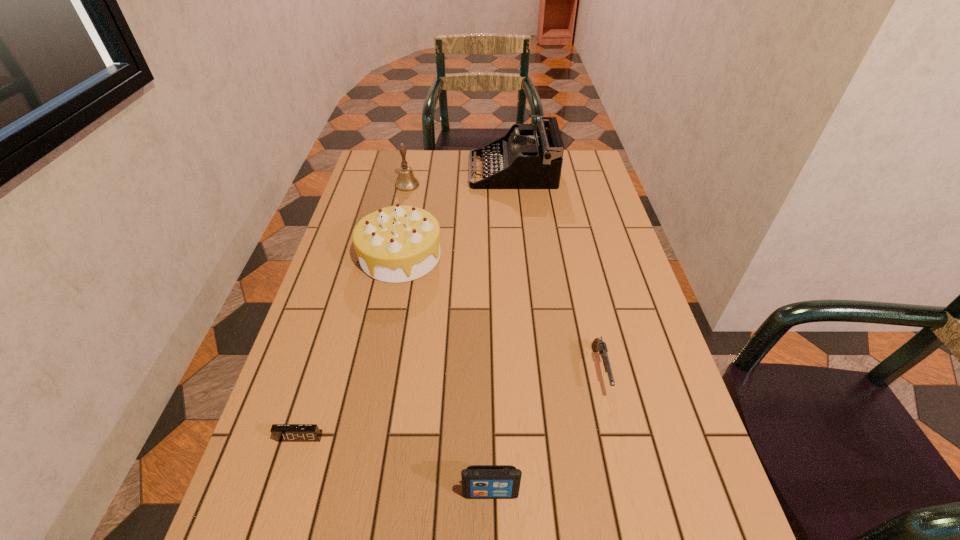
The width and height of the screenshot is (960, 540). I want to click on vacant space located on the typing side of the typewriter, so click(410, 171).

At what (x,y) coordinates should I click in order to perform the action: click on vacant space situated 0.200m on the typing side of the typewriter. Please return your answer as a coordinate pair (x, y). The image size is (960, 540). Looking at the image, I should click on (418, 171).

I want to click on vacant space situated 0.180m on the back of the bell, so click(x=414, y=154).

Identify the location of vacant region located 0.200m on the right of the fourth nearest object. This screenshot has height=540, width=960. (507, 255).

You are a GUI agent. You are given a task and a screenshot of the screen. Output one action in this format:
    pyautogui.click(x=<x>, y=<y>)
    Task: Click on the free region located 0.130m aiming along the barrel of the gun
    The width and height of the screenshot is (960, 540).
    Given the screenshot: What is the action you would take?
    pyautogui.click(x=620, y=458)

Where is `vacant area located on the front-facing side of the alarm clock`? This screenshot has height=540, width=960. vacant area located on the front-facing side of the alarm clock is located at coordinates (281, 497).

At what (x,y) coordinates should I click in order to perform the action: click on typewriter situated at the far edge. Please return your answer as a coordinate pair (x, y). The width and height of the screenshot is (960, 540). Looking at the image, I should click on (524, 158).

Find the location of a particular element. bell at the far edge is located at coordinates (406, 181).

Find the location of `bell that is at the left edge`. bell that is at the left edge is located at coordinates (406, 181).

Find the location of a particular element. The height and width of the screenshot is (540, 960). birthday cake that is at the left edge is located at coordinates (395, 244).